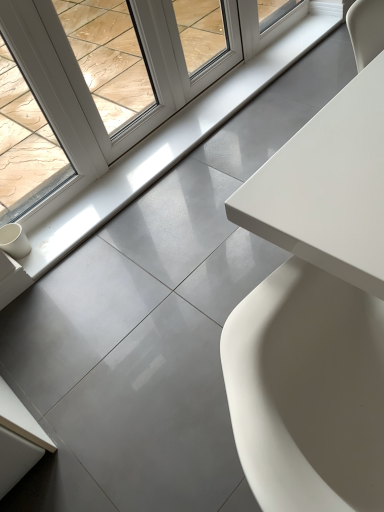
Measure the distance between white glossy window at upper left and camera.

A distance of 1.43 meters exists between white glossy window at upper left and camera.

At what (x,y) coordinates should I click in order to perform the action: click on white glossy window at upper left. Please return your answer as a coordinate pair (x, y). Looking at the image, I should click on pyautogui.click(x=88, y=87).

What do you see at coordinates (88, 87) in the screenshot? I see `white glossy window at upper left` at bounding box center [88, 87].

Image resolution: width=384 pixels, height=512 pixels. I want to click on white glossy window at upper left, so click(x=88, y=87).